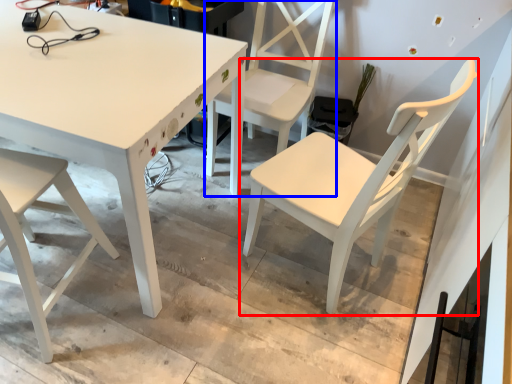
Question: Which object appears farthest to the camera in this image, chair (highlighted by a red box) or chair (highlighted by a blue box)?

Choices:
 (A) chair
 (B) chair

Answer: (B)